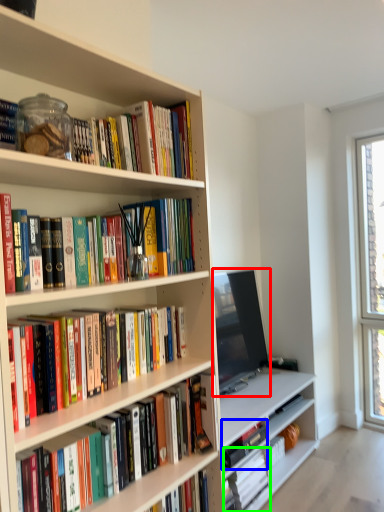
Question: Estimate the real-world distances between objects in this image. Which object is closer to television (highlighted by a red box), book (highlighted by a blue box) or book (highlighted by a green box)?

Choices:
 (A) book
 (B) book

Answer: (A)